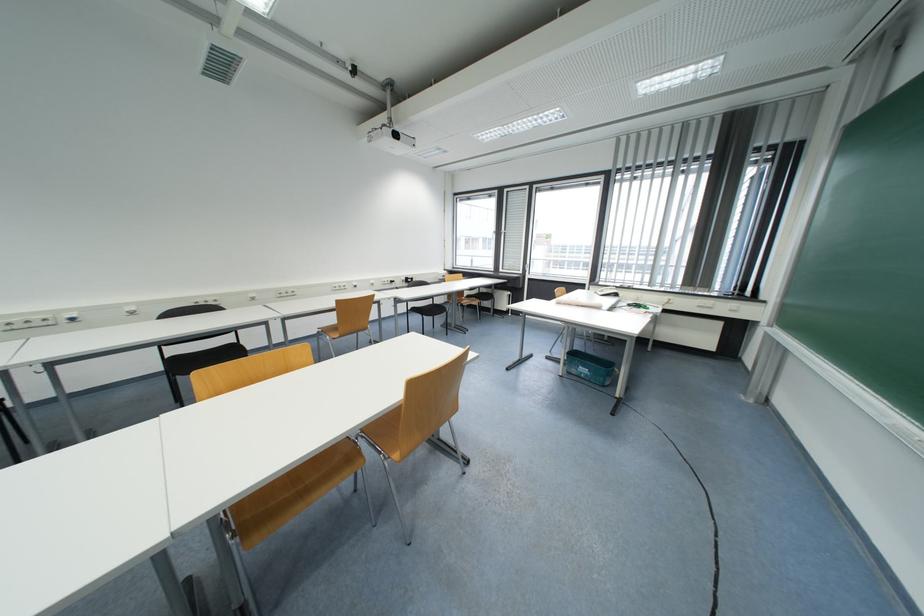
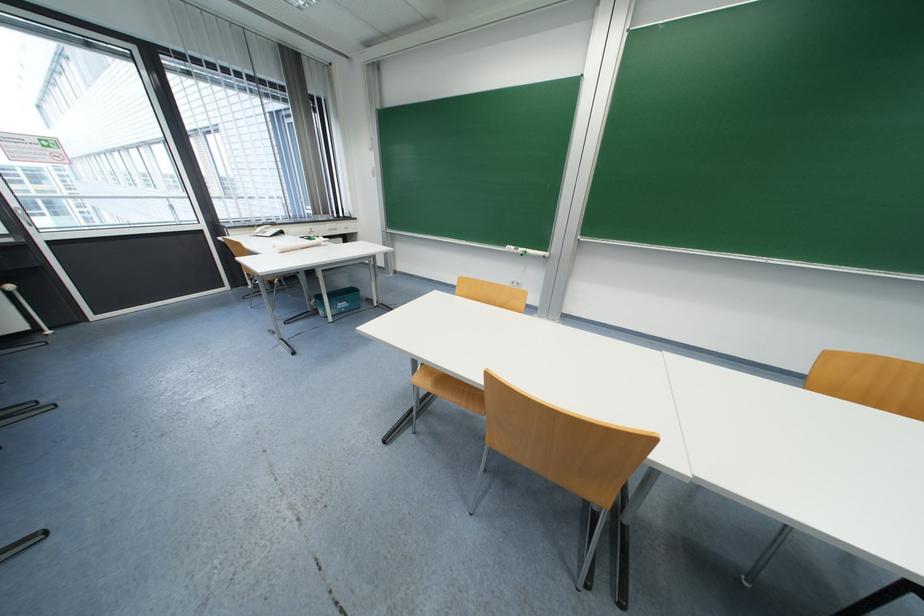
The point at (590, 377) is marked in the first image. Where is the corresponding point in the second image?

(350, 310)